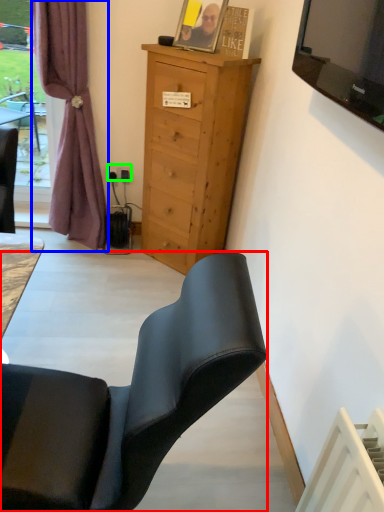
Question: Which object is positioned closest to chair (highlighted by a red box)? Select from curtain (highlighted by a blue box) and power outlet (highlighted by a green box).

Choices:
 (A) curtain
 (B) power outlet

Answer: (A)